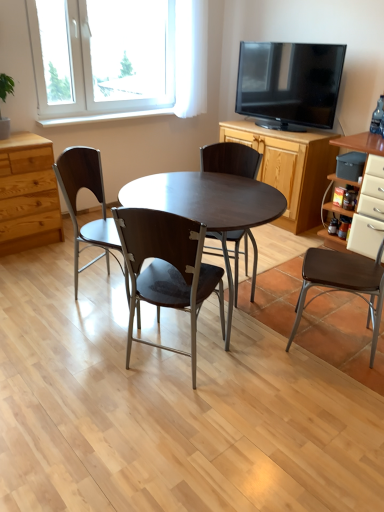
Locate an element on the screen. This screenshot has height=512, width=384. vacant space that is to the left of matte dark wood table at center is located at coordinates tap(60, 335).